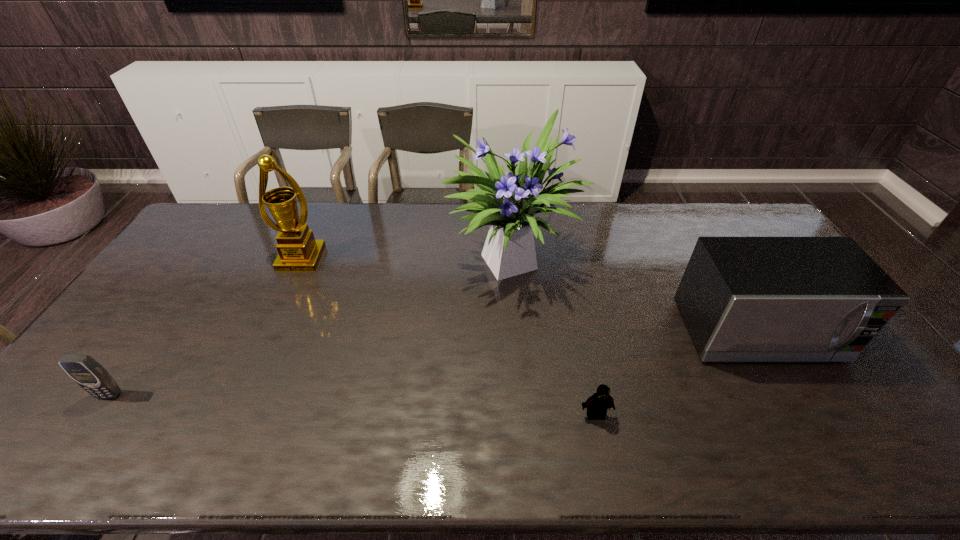
The width and height of the screenshot is (960, 540). I want to click on the tallest object, so click(x=508, y=205).

Where is `the second tallest object`? Image resolution: width=960 pixels, height=540 pixels. the second tallest object is located at coordinates (298, 251).

This screenshot has height=540, width=960. In order to click on the fourth object from right to left in this screenshot , I will do `click(298, 251)`.

Find the location of a particular element. The image size is (960, 540). microwave oven is located at coordinates [x=743, y=299].

I want to click on the rightmost object, so click(x=743, y=299).

The height and width of the screenshot is (540, 960). I want to click on the second nearest object, so click(x=83, y=369).

You are a GUI agent. You are given a task and a screenshot of the screen. Output one action in this format:
    pyautogui.click(x=<x>, y=<y>)
    Task: Click on the leftmost object
    This screenshot has height=540, width=960.
    Given the screenshot: What is the action you would take?
    pyautogui.click(x=83, y=369)

Find the location of a particular element. Image resolution: width=960 pixels, height=540 pixels. the nearest object is located at coordinates (598, 404).

Locate an element on the screen. Image resolution: width=960 pixels, height=540 pixels. the shortest object is located at coordinates (598, 404).

This screenshot has height=540, width=960. I want to click on free space located 0.190m on the right of the flower arrangement, so click(x=636, y=257).